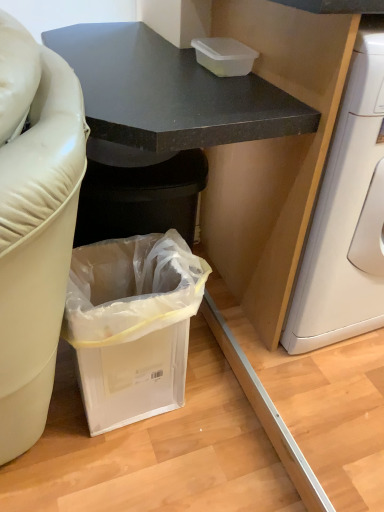
Describe the element at coordinates (170, 92) in the screenshot. I see `matte black cabinet at lower left` at that location.

The height and width of the screenshot is (512, 384). I want to click on transparent plastic container at upper center, so click(x=224, y=56).

Is clear plastic trash can at lower left next to transparent plastic container at upper center and touching it?

No, clear plastic trash can at lower left is not making contact with transparent plastic container at upper center.

Between point (173, 234) and point (220, 46), which one is positioned in front?

The point (173, 234) is in front.

Can we say clear plastic trash can at lower left lies outside transparent plastic container at upper center?

Yes, clear plastic trash can at lower left is located beyond the bounds of transparent plastic container at upper center.

From the image's perspective, between clear plastic trash can at lower left and transparent plastic container at upper center, which one is located above?

From the image's view, transparent plastic container at upper center is above.

From a real-world perspective, relative to matte black cabinet at lower left, is clear plastic trash can at lower left vertically above or below?

clear plastic trash can at lower left is situated lower than matte black cabinet at lower left in the real world.

Is clear plastic trash can at lower left smaller than matte black cabinet at lower left?

Yes.

In the image, is clear plastic trash can at lower left positioned in front of or behind matte black cabinet at lower left?

In the image, clear plastic trash can at lower left appears behind matte black cabinet at lower left.

Which point is more forward, (93, 381) or (135, 62)?

The point (93, 381) is in front.

Could you measure the distance between matte black cabinet at lower left and transparent plastic container at upper center?

matte black cabinet at lower left and transparent plastic container at upper center are 8.26 inches apart.

Would you say matte black cabinet at lower left is inside or outside transparent plastic container at upper center?

matte black cabinet at lower left exists outside the volume of transparent plastic container at upper center.

Can you tell me how much matte black cabinet at lower left and transparent plastic container at upper center differ in facing direction?

The facing directions of matte black cabinet at lower left and transparent plastic container at upper center are 0.00167 degrees apart.

From the image's perspective, is matte black cabinet at lower left on transparent plastic container at upper center?

Incorrect, from the image's perspective, matte black cabinet at lower left is lower than transparent plastic container at upper center.

Considering the sizes of objects transparent plastic container at upper center and matte black cabinet at lower left in the image provided, who is shorter, transparent plastic container at upper center or matte black cabinet at lower left?

transparent plastic container at upper center.

Does transparent plastic container at upper center appear on the right side of matte black cabinet at lower left?

Correct, you'll find transparent plastic container at upper center to the right of matte black cabinet at lower left.

Considering the sizes of objects transparent plastic container at upper center and matte black cabinet at lower left in the image provided, who is smaller, transparent plastic container at upper center or matte black cabinet at lower left?

transparent plastic container at upper center.

From the image's perspective, which one is positioned lower, transparent plastic container at upper center or matte black cabinet at lower left?

From the image's view, matte black cabinet at lower left is below.

From the image's perspective, is matte black cabinet at lower left positioned above or below clear plastic trash can at lower left?

Clearly, from the image's perspective, matte black cabinet at lower left is above clear plastic trash can at lower left.

In the image, is matte black cabinet at lower left on the left side or the right side of clear plastic trash can at lower left?

Clearly, matte black cabinet at lower left is on the left of clear plastic trash can at lower left in the image.

How different are the orientations of matte black cabinet at lower left and clear plastic trash can at lower left in degrees?

The angular difference between matte black cabinet at lower left and clear plastic trash can at lower left is 0.000382 degrees.

Who is taller, matte black cabinet at lower left or clear plastic trash can at lower left?

matte black cabinet at lower left.

From a real-world perspective, is transparent plastic container at upper center positioned under clear plastic trash can at lower left based on gravity?

No.

From the image's perspective, is transparent plastic container at upper center beneath clear plastic trash can at lower left?

No.

Considering the points (234, 53) and (170, 367), which point is behind, point (234, 53) or point (170, 367)?

The point (170, 367) is more distant.

Locate an element on the screen. The width and height of the screenshot is (384, 512). trash bin/can below the transparent plastic container at upper center (from a real-world perspective) is located at coordinates click(132, 325).

This screenshot has width=384, height=512. In order to click on trash bin/can on the right side of matte black cabinet at lower left in this screenshot , I will do `click(132, 325)`.

Estimate the real-world distances between objects in this image. Which object is further from clear plastic trash can at lower left, matte black cabinet at lower left or transparent plastic container at upper center?

transparent plastic container at upper center is positioned further to the anchor clear plastic trash can at lower left.

Which object lies nearer to the anchor point transparent plastic container at upper center, clear plastic trash can at lower left or matte black cabinet at lower left?

matte black cabinet at lower left.

Considering their positions, is matte black cabinet at lower left positioned further to transparent plastic container at upper center than clear plastic trash can at lower left?

clear plastic trash can at lower left is positioned further to the anchor transparent plastic container at upper center.

Considering their positions, is transparent plastic container at upper center positioned closer to matte black cabinet at lower left than clear plastic trash can at lower left?

transparent plastic container at upper center lies closer to matte black cabinet at lower left than the other object.

Estimate the real-world distances between objects in this image. Which object is closer to matte black cabinet at lower left, clear plastic trash can at lower left or transparent plastic container at upper center?

transparent plastic container at upper center is positioned closer to the anchor matte black cabinet at lower left.

When comparing their distances from clear plastic trash can at lower left, does transparent plastic container at upper center or matte black cabinet at lower left seem further?

Based on the image, transparent plastic container at upper center appears to be further to clear plastic trash can at lower left.

What are the coordinates of `cabinetry between transparent plastic container at upper center and clear plastic trash can at lower left from top to bottom` in the screenshot? It's located at (170, 92).